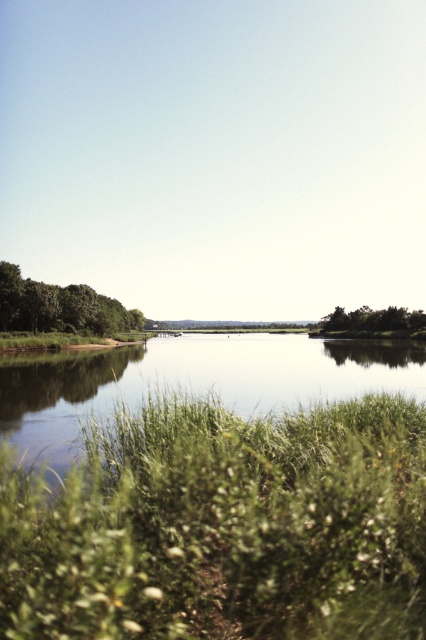
You are standing on the bank of the green grassy river at center and want to walk towards the green matte tree at left. Which direction should you head to reach it?

To reach the green matte tree at left from the green grassy river at center, you should head north because the green grassy river at center is below the green matte tree at left, meaning the tree is located north of the river.

You are a photographer who wants to capture the green grassy river at center and the green matte tree at left in a single shot. Based on the scene, which object will occupy more space in the photo?

The green grassy river at center will occupy more space in the photo because it has a larger size compared to the green matte tree at left.

You are standing at the edge of the water in the middle ground of the serene natural landscape. You notice a point marked at coordinates (222, 528). What is located at this point?

The point at coordinates (222, 528) marks green fuzzy grass at lower center.